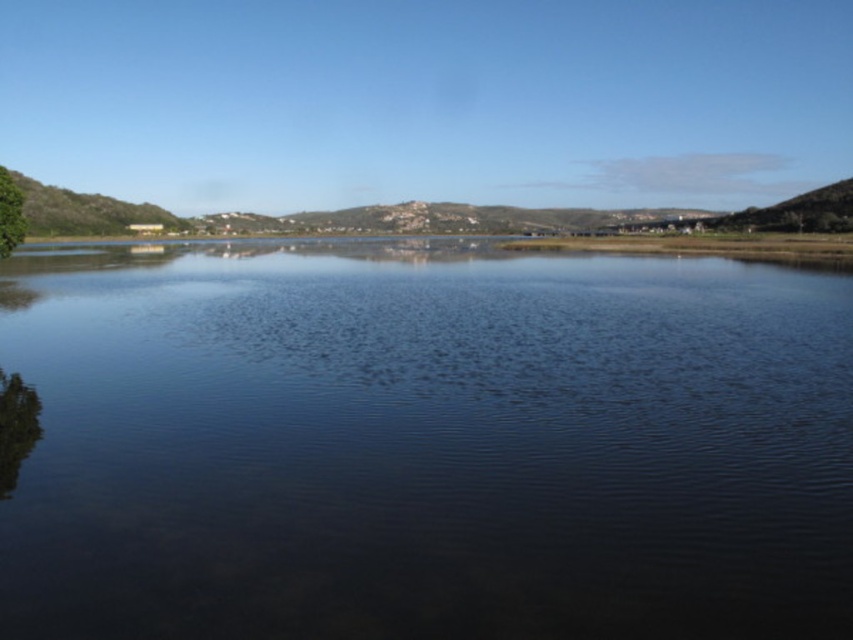
You are standing on the bank of the lake and see the transparent water at center and the green leafy tree at left. Which object is closer to you?

The transparent water at center is closer to you than the green leafy tree at left because it is taller in the image, indicating it occupies a lower position in the visual hierarchy, which typically corresponds to being nearer in such landscapes.

You are standing at the edge of the scene and want to walk from the green leafy tree at left to the transparent water at center. Which direction should you head?

To reach the transparent water at center from the green leafy tree at left, you should head to the right since the transparent water at center is positioned on the right side of the green leafy tree at left.